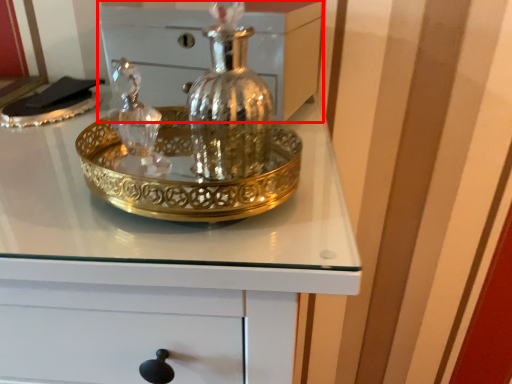
Question: From the image, what is the correct spatial relationship of chest (annotated by the red box) in relation to chest of drawers?

Choices:
 (A) right
 (B) left

Answer: (A)